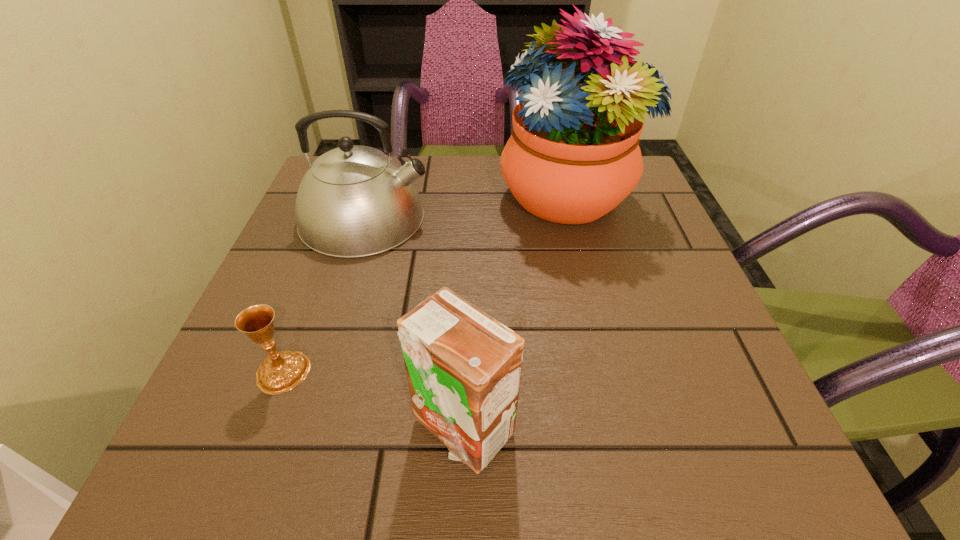
Locate an element on the screen. This screenshot has width=960, height=540. free space between the kettle and the flower arrangement is located at coordinates (467, 206).

At what (x,y) coordinates should I click in order to perform the action: click on free point between the tallest object and the chalice. Please return your answer as a coordinate pair (x, y). Image resolution: width=960 pixels, height=540 pixels. Looking at the image, I should click on (425, 283).

Where is `free space between the kettle and the tallest object`? The image size is (960, 540). free space between the kettle and the tallest object is located at coordinates (467, 206).

Identify which object is the second nearest to the carton. Please provide its 2D coordinates. Your answer should be formatted as a tuple, i.e. [(x, y)], where the tuple contains the x and y coordinates of a point satisfying the conditions above.

[(354, 201)]

Identify the location of object that stands as the closest to the flower arrangement. tap(354, 201).

Where is `vacant space that satisfies the following two spatial constraints: 1. on the back side of the tallest object; 2. on the left side of the shortest object`? The width and height of the screenshot is (960, 540). vacant space that satisfies the following two spatial constraints: 1. on the back side of the tallest object; 2. on the left side of the shortest object is located at coordinates click(350, 194).